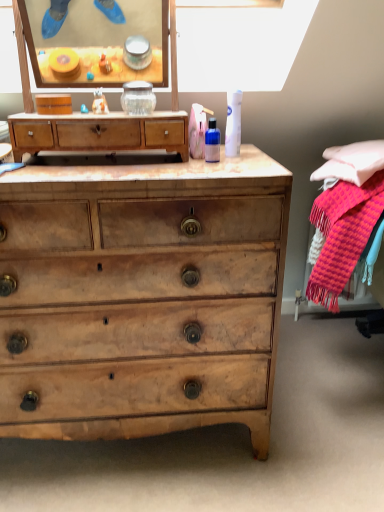
Describe the element at coordinates (141, 297) in the screenshot. This screenshot has width=384, height=512. I see `light brown wood chest of drawers at center, acting as the 2th chest of drawers starting from the top` at that location.

You are a GUI agent. You are given a task and a screenshot of the screen. Output one action in this format:
    pyautogui.click(x=<x>, y=<y>)
    Task: Click on the light brown wooden chest of drawers at center, the second chest of drawers in the bottom-to-top sequence
    
    Given the screenshot: What is the action you would take?
    pyautogui.click(x=99, y=133)

What is the approximate height of light brown wooden chest of drawers at center, the second chest of drawers in the bottom-to-top sequence?

It is 4.95 inches.

How much space does translucent plastic bottle at center, which is counted as the second toiletry, starting from the right, occupy vertically?

4.57 inches.

Image resolution: width=384 pixels, height=512 pixels. Describe the element at coordinates (233, 123) in the screenshot. I see `white matte canister at upper center, acting as the first toiletry starting from the right` at that location.

The height and width of the screenshot is (512, 384). I want to click on light brown wood chest of drawers at center, which is the first chest of drawers in bottom-to-top order, so click(x=141, y=297).

From the picture: From a real-world perspective, is white matte canister at upper center, acting as the first toiletry starting from the right, under light brown wood chest of drawers at center, acting as the 2th chest of drawers starting from the top?

No, from a real-world perspective, white matte canister at upper center, acting as the first toiletry starting from the right, is not under light brown wood chest of drawers at center, acting as the 2th chest of drawers starting from the top.

You are a GUI agent. You are given a task and a screenshot of the screen. Output one action in this format:
    pyautogui.click(x=<x>, y=<y>)
    Task: Click on the chest of drawers that is the 2nd one when counting forward from the white matte canister at upper center, positioned as the 2th toiletry in left-to-right order
    The image size is (384, 512).
    Given the screenshot: What is the action you would take?
    pyautogui.click(x=141, y=297)

Based on their sizes in the image, would you say white matte canister at upper center, acting as the first toiletry starting from the right, is bigger or smaller than light brown wood chest of drawers at center, acting as the 2th chest of drawers starting from the top?

Considering their sizes, white matte canister at upper center, acting as the first toiletry starting from the right, takes up less space than light brown wood chest of drawers at center, acting as the 2th chest of drawers starting from the top.

Measure the distance between white matte canister at upper center, positioned as the 2th toiletry in left-to-right order, and light brown wood chest of drawers at center, acting as the 2th chest of drawers starting from the top.

A distance of 20.58 inches exists between white matte canister at upper center, positioned as the 2th toiletry in left-to-right order, and light brown wood chest of drawers at center, acting as the 2th chest of drawers starting from the top.

Based on their sizes in the image, would you say light brown wooden chest of drawers at center, which ranks as the first chest of drawers in top-to-bottom order, is bigger or smaller than translucent plastic bottle at center, which is counted as the second toiletry, starting from the right?

Clearly, light brown wooden chest of drawers at center, which ranks as the first chest of drawers in top-to-bottom order, is larger in size than translucent plastic bottle at center, which is counted as the second toiletry, starting from the right.

I want to click on the 1st toiletry behind the light brown wooden chest of drawers at center, which ranks as the first chest of drawers in top-to-bottom order, starting your count from the anchor, so click(212, 142).

From a real-world perspective, is light brown wooden chest of drawers at center, which ranks as the first chest of drawers in top-to-bottom order, on translucent plastic bottle at center, which is counted as the second toiletry, starting from the right?

Yes, from a real-world perspective, light brown wooden chest of drawers at center, which ranks as the first chest of drawers in top-to-bottom order, is on top of translucent plastic bottle at center, which is counted as the second toiletry, starting from the right.

Can you tell me how much light brown wood chest of drawers at center, which is the first chest of drawers in bottom-to-top order, and white matte canister at upper center, acting as the first toiletry starting from the right, differ in facing direction?

They differ by 0.259 degrees in their facing directions.

Consider the image. Does light brown wood chest of drawers at center, which is the first chest of drawers in bottom-to-top order, appear on the left side of white matte canister at upper center, positioned as the 2th toiletry in left-to-right order?

Correct, you'll find light brown wood chest of drawers at center, which is the first chest of drawers in bottom-to-top order, to the left of white matte canister at upper center, positioned as the 2th toiletry in left-to-right order.

From the image's perspective, who appears lower, light brown wood chest of drawers at center, which is the first chest of drawers in bottom-to-top order, or white matte canister at upper center, positioned as the 2th toiletry in left-to-right order?

light brown wood chest of drawers at center, which is the first chest of drawers in bottom-to-top order, from the image's perspective.

From a real-world perspective, who is located lower, light brown wood chest of drawers at center, which is the first chest of drawers in bottom-to-top order, or white matte canister at upper center, positioned as the 2th toiletry in left-to-right order?

From a 3D spatial view, light brown wood chest of drawers at center, which is the first chest of drawers in bottom-to-top order, is below.

Which is more to the left, translucent plastic bottle at center, positioned as the first toiletry in left-to-right order, or light brown wooden chest of drawers at center, which ranks as the first chest of drawers in top-to-bottom order?

light brown wooden chest of drawers at center, which ranks as the first chest of drawers in top-to-bottom order, is more to the left.

Is translucent plastic bottle at center, positioned as the first toiletry in left-to-right order, further to camera compared to light brown wooden chest of drawers at center, which ranks as the first chest of drawers in top-to-bottom order?

Yes, it is behind light brown wooden chest of drawers at center, which ranks as the first chest of drawers in top-to-bottom order.

What's the angular difference between translucent plastic bottle at center, which is counted as the second toiletry, starting from the right, and light brown wooden chest of drawers at center, the second chest of drawers in the bottom-to-top sequence,'s facing directions?

There is a 0.0101-degree angle between the facing directions of translucent plastic bottle at center, which is counted as the second toiletry, starting from the right, and light brown wooden chest of drawers at center, the second chest of drawers in the bottom-to-top sequence.

Considering the relative sizes of translucent plastic bottle at center, which is counted as the second toiletry, starting from the right, and light brown wooden chest of drawers at center, the second chest of drawers in the bottom-to-top sequence, in the image provided, is translucent plastic bottle at center, which is counted as the second toiletry, starting from the right, shorter than light brown wooden chest of drawers at center, the second chest of drawers in the bottom-to-top sequence,?

Indeed, translucent plastic bottle at center, which is counted as the second toiletry, starting from the right, has a lesser height compared to light brown wooden chest of drawers at center, the second chest of drawers in the bottom-to-top sequence.

Between light brown wood chest of drawers at center, which is the first chest of drawers in bottom-to-top order, and translucent plastic bottle at center, which is counted as the second toiletry, starting from the right, which one has larger size?

With larger size is light brown wood chest of drawers at center, which is the first chest of drawers in bottom-to-top order.

From a real-world perspective, which is physically below, light brown wood chest of drawers at center, acting as the 2th chest of drawers starting from the top, or translucent plastic bottle at center, which is counted as the second toiletry, starting from the right?

light brown wood chest of drawers at center, acting as the 2th chest of drawers starting from the top, from a real-world perspective.

From the picture: Can you confirm if light brown wood chest of drawers at center, acting as the 2th chest of drawers starting from the top, is shorter than translucent plastic bottle at center, positioned as the first toiletry in left-to-right order?

No.

Is translucent plastic bottle at center, which is counted as the second toiletry, starting from the right, at the back of light brown wood chest of drawers at center, which is the first chest of drawers in bottom-to-top order?

That's not correct — light brown wood chest of drawers at center, which is the first chest of drawers in bottom-to-top order, is not looking away from translucent plastic bottle at center, which is counted as the second toiletry, starting from the right.

Is point (231, 130) in front of point (16, 146)?

No, it is not.

Can light brown wooden chest of drawers at center, which ranks as the first chest of drawers in top-to-bottom order, be found inside white matte canister at upper center, positioned as the 2th toiletry in left-to-right order?

No, white matte canister at upper center, positioned as the 2th toiletry in left-to-right order, does not contain light brown wooden chest of drawers at center, which ranks as the first chest of drawers in top-to-bottom order.

From the image's perspective, is white matte canister at upper center, acting as the first toiletry starting from the right, positioned above or below light brown wooden chest of drawers at center, which ranks as the first chest of drawers in top-to-bottom order?

Clearly, from the image's perspective, white matte canister at upper center, acting as the first toiletry starting from the right, is above light brown wooden chest of drawers at center, which ranks as the first chest of drawers in top-to-bottom order.

Is light brown wooden chest of drawers at center, which ranks as the first chest of drawers in top-to-bottom order, completely or partially inside light brown wood chest of drawers at center, which is the first chest of drawers in bottom-to-top order?

No, light brown wooden chest of drawers at center, which ranks as the first chest of drawers in top-to-bottom order, is not surrounded by light brown wood chest of drawers at center, which is the first chest of drawers in bottom-to-top order.

Based on the photo, is light brown wood chest of drawers at center, which is the first chest of drawers in bottom-to-top order, taller or shorter than light brown wooden chest of drawers at center, the second chest of drawers in the bottom-to-top sequence?

Considering their sizes, light brown wood chest of drawers at center, which is the first chest of drawers in bottom-to-top order, has more height than light brown wooden chest of drawers at center, the second chest of drawers in the bottom-to-top sequence.

Is light brown wood chest of drawers at center, which is the first chest of drawers in bottom-to-top order, looking in the opposite direction of light brown wooden chest of drawers at center, which ranks as the first chest of drawers in top-to-bottom order?

No, light brown wood chest of drawers at center, which is the first chest of drawers in bottom-to-top order,'s orientation is not away from light brown wooden chest of drawers at center, which ranks as the first chest of drawers in top-to-bottom order.

Consider the image. Which object is wider, light brown wood chest of drawers at center, which is the first chest of drawers in bottom-to-top order, or light brown wooden chest of drawers at center, the second chest of drawers in the bottom-to-top sequence?

With larger width is light brown wood chest of drawers at center, which is the first chest of drawers in bottom-to-top order.

Find the location of a particular element. the 2nd chest of drawers below when counting from the white matte canister at upper center, acting as the first toiletry starting from the right (from the image's perspective) is located at coordinates (141, 297).

Locate an element on the screen. Image resolution: width=384 pixels, height=512 pixels. chest of drawers above the translucent plastic bottle at center, positioned as the first toiletry in left-to-right order (from a real-world perspective) is located at coordinates (99, 133).

Looking at the image, which one is located closer to translucent plastic bottle at center, positioned as the first toiletry in left-to-right order, white matte canister at upper center, acting as the first toiletry starting from the right, or light brown wooden chest of drawers at center, which ranks as the first chest of drawers in top-to-bottom order?

white matte canister at upper center, acting as the first toiletry starting from the right, lies closer to translucent plastic bottle at center, positioned as the first toiletry in left-to-right order, than the other object.

When comparing their distances from light brown wooden chest of drawers at center, which ranks as the first chest of drawers in top-to-bottom order, does translucent plastic bottle at center, positioned as the first toiletry in left-to-right order, or white matte canister at upper center, acting as the first toiletry starting from the right, seem further?

white matte canister at upper center, acting as the first toiletry starting from the right, is positioned further to the anchor light brown wooden chest of drawers at center, which ranks as the first chest of drawers in top-to-bottom order.

Which object lies nearer to the anchor point translucent plastic bottle at center, positioned as the first toiletry in left-to-right order, white matte canister at upper center, acting as the first toiletry starting from the right, or light brown wood chest of drawers at center, acting as the 2th chest of drawers starting from the top?

Among the two, white matte canister at upper center, acting as the first toiletry starting from the right, is located nearer to translucent plastic bottle at center, positioned as the first toiletry in left-to-right order.

Which object lies further to the anchor point translucent plastic bottle at center, which is counted as the second toiletry, starting from the right, light brown wooden chest of drawers at center, which ranks as the first chest of drawers in top-to-bottom order, or white matte canister at upper center, acting as the first toiletry starting from the right?

The object further to translucent plastic bottle at center, which is counted as the second toiletry, starting from the right, is light brown wooden chest of drawers at center, which ranks as the first chest of drawers in top-to-bottom order.

From the image, which object appears to be farther from light brown wood chest of drawers at center, acting as the 2th chest of drawers starting from the top, translucent plastic bottle at center, which is counted as the second toiletry, starting from the right, or white matte canister at upper center, positioned as the 2th toiletry in left-to-right order?

Among the two, white matte canister at upper center, positioned as the 2th toiletry in left-to-right order, is located further to light brown wood chest of drawers at center, acting as the 2th chest of drawers starting from the top.

Which object lies nearer to the anchor point white matte canister at upper center, positioned as the 2th toiletry in left-to-right order, translucent plastic bottle at center, which is counted as the second toiletry, starting from the right, or light brown wooden chest of drawers at center, the second chest of drawers in the bottom-to-top sequence?

translucent plastic bottle at center, which is counted as the second toiletry, starting from the right, lies closer to white matte canister at upper center, positioned as the 2th toiletry in left-to-right order, than the other object.

Based on their spatial positions, is light brown wood chest of drawers at center, acting as the 2th chest of drawers starting from the top, or light brown wooden chest of drawers at center, the second chest of drawers in the bottom-to-top sequence, closer to white matte canister at upper center, acting as the first toiletry starting from the right?

Among the two, light brown wooden chest of drawers at center, the second chest of drawers in the bottom-to-top sequence, is located nearer to white matte canister at upper center, acting as the first toiletry starting from the right.

Considering their positions, is light brown wood chest of drawers at center, acting as the 2th chest of drawers starting from the top, positioned closer to white matte canister at upper center, positioned as the 2th toiletry in left-to-right order, than translucent plastic bottle at center, which is counted as the second toiletry, starting from the right?

translucent plastic bottle at center, which is counted as the second toiletry, starting from the right.

Locate an element on the screen. The height and width of the screenshot is (512, 384). toiletry between white matte canister at upper center, acting as the first toiletry starting from the right, and light brown wood chest of drawers at center, which is the first chest of drawers in bottom-to-top order, vertically is located at coordinates (212, 142).

The width and height of the screenshot is (384, 512). In order to click on chest of drawers between white matte canister at upper center, acting as the first toiletry starting from the right, and light brown wood chest of drawers at center, acting as the 2th chest of drawers starting from the top, in the up-down direction in this screenshot , I will do `click(99, 133)`.

Find the location of a particular element. The image size is (384, 512). toiletry between light brown wooden chest of drawers at center, which ranks as the first chest of drawers in top-to-bottom order, and light brown wood chest of drawers at center, which is the first chest of drawers in bottom-to-top order, in the vertical direction is located at coordinates (212, 142).

Image resolution: width=384 pixels, height=512 pixels. What are the coordinates of `toiletry situated between light brown wooden chest of drawers at center, which ranks as the first chest of drawers in top-to-bottom order, and white matte canister at upper center, positioned as the 2th toiletry in left-to-right order, from left to right` in the screenshot? It's located at (212, 142).